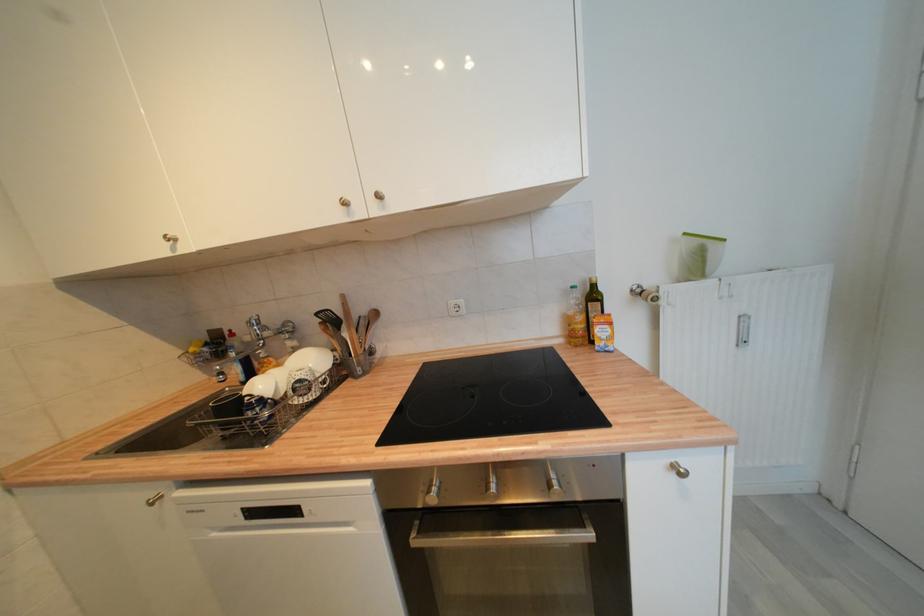
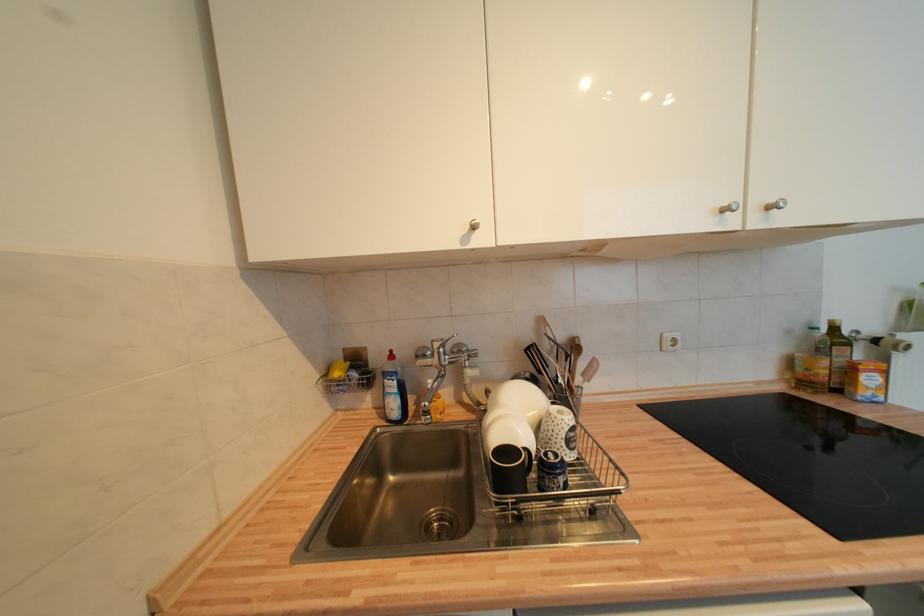
Locate, in the second image, the point that corresponds to the point at 578,289 in the first image.

(819, 331)